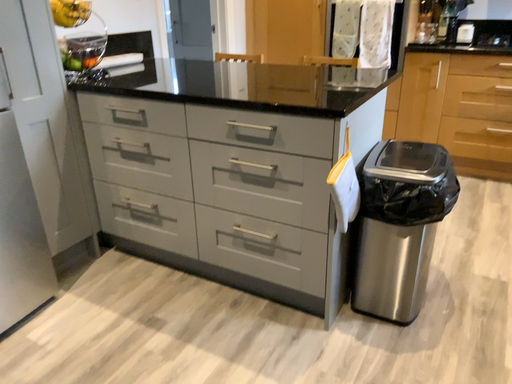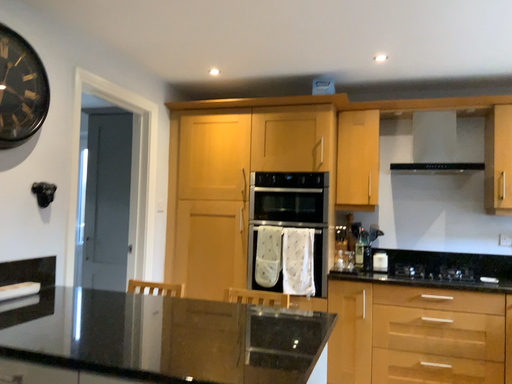
Question: Which way did the camera rotate in the video?

Choices:
 (A) rotated downward
 (B) rotated upward

Answer: (B)